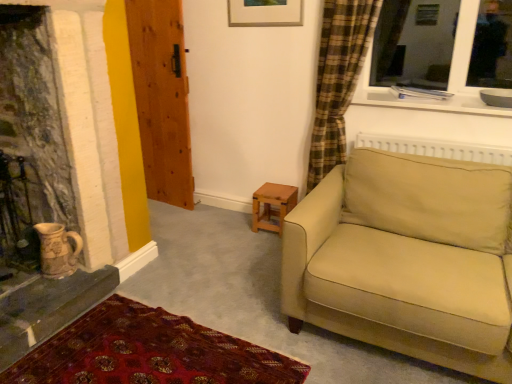
Where is `space that is in front of wooden door at left`? space that is in front of wooden door at left is located at coordinates (166, 213).